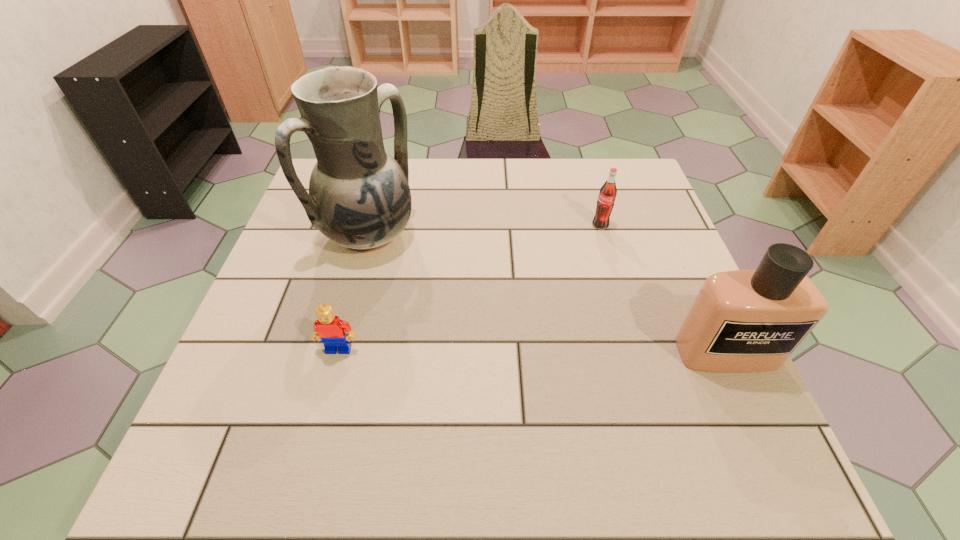
Identify the location of vacant area at the far edge of the desktop. Image resolution: width=960 pixels, height=540 pixels. (453, 165).

At what (x,y) coordinates should I click in order to perform the action: click on free space at the near edge of the desktop. Please return your answer as a coordinate pair (x, y). This screenshot has height=540, width=960. Looking at the image, I should click on (444, 392).

I want to click on vacant space at the left edge, so click(257, 345).

Identify the location of vacant space at the right edge of the desktop. (652, 288).

The image size is (960, 540). I want to click on vacant space at the near left corner, so coord(220,407).

At what (x,y) coordinates should I click in order to perform the action: click on free space at the far right corner of the desktop. Please return your answer as a coordinate pair (x, y). Looking at the image, I should click on point(608,160).

At what (x,y) coordinates should I click in order to perform the action: click on free point between the third object from left to right and the Lego. Please return your answer as a coordinate pair (x, y). The image size is (960, 540). Looking at the image, I should click on (469, 287).

Locate an element on the screen. free space between the perfume and the soda bottle is located at coordinates (663, 289).

Identify the location of vacant region between the rightmost object and the shortest object. (533, 351).

I want to click on empty space between the tallest object and the second object from right to left, so [x=485, y=231].